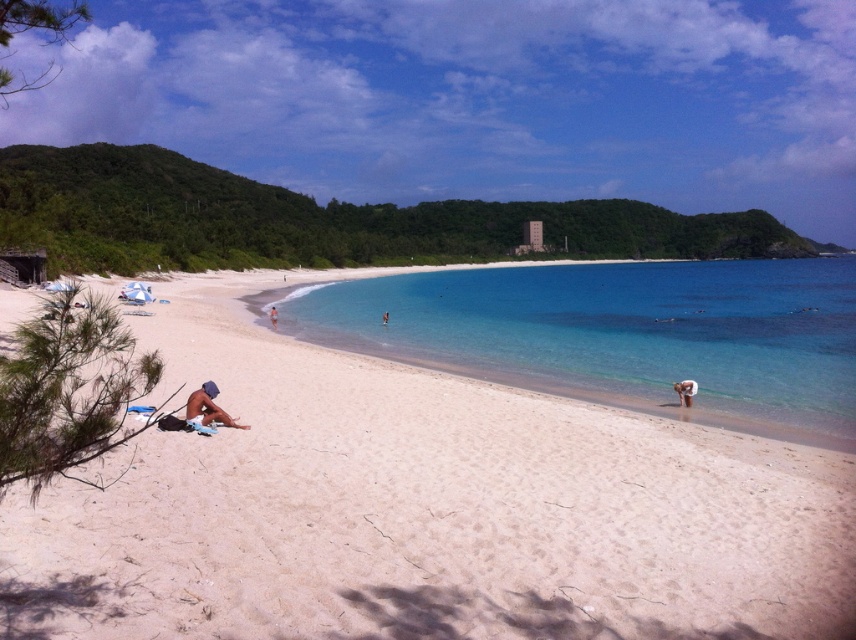
Question: Which of these objects is positioned closest to the green leafy island at center?

Choices:
 (A) tan skin person at center
 (B) clear blue water at center
 (C) brown sand at lower center
 (D) tan skin person at lower right

Answer: (B)

Question: Which point is farther to the camera?

Choices:
 (A) skinny white sand at lower left
 (B) green leafy island at center

Answer: (B)

Question: Does green leafy island at center have a larger size compared to brown sand at lower center?

Choices:
 (A) no
 (B) yes

Answer: (B)

Question: Which object is the farthest from the clear blue water at center?

Choices:
 (A) green leafy island at center
 (B) tan skin person at center
 (C) skinny white sand at lower left

Answer: (A)

Question: Does tan skin person at center appear over brown sand at lower center?

Choices:
 (A) yes
 (B) no

Answer: (A)

Question: Does white sand at center appear on the left side of tan skin person at lower right?

Choices:
 (A) no
 (B) yes

Answer: (B)